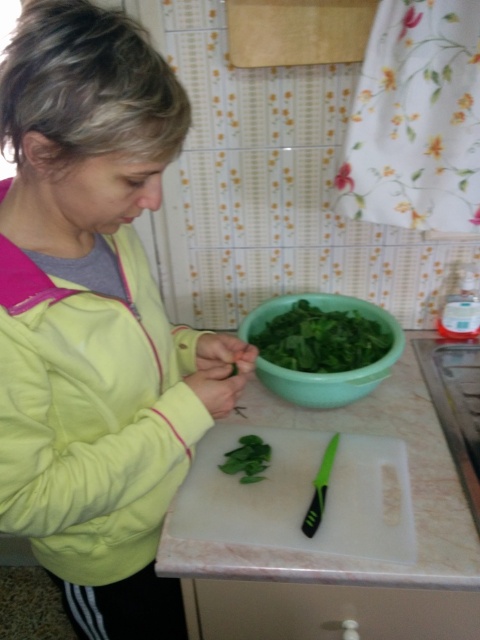
Question: Does white plastic cutting board at center appear on the left side of green leafy vegetable at center?

Choices:
 (A) yes
 (B) no

Answer: (B)

Question: Which point is closer to the camera?

Choices:
 (A) (226, 458)
 (B) (101, 138)
 (C) (267, 472)
 (D) (260, 378)

Answer: (B)

Question: Is white plastic cutting board at center closer to the viewer compared to green leafy vegetable at center?

Choices:
 (A) yes
 (B) no

Answer: (A)

Question: Which object is the farthest from the yellow fabric jacket at center?

Choices:
 (A) white plastic cutting board at center
 (B) green plastic bowl at center
 (C) green leafy vegetable at center

Answer: (C)

Question: Which of the following is the farthest from the observer?

Choices:
 (A) green leafy vegetable at center
 (B) white plastic cutting board at center
 (C) yellow fabric jacket at center

Answer: (A)

Question: Is the position of yellow fabric jacket at center less distant than that of white plastic cutting board at center?

Choices:
 (A) no
 (B) yes

Answer: (B)